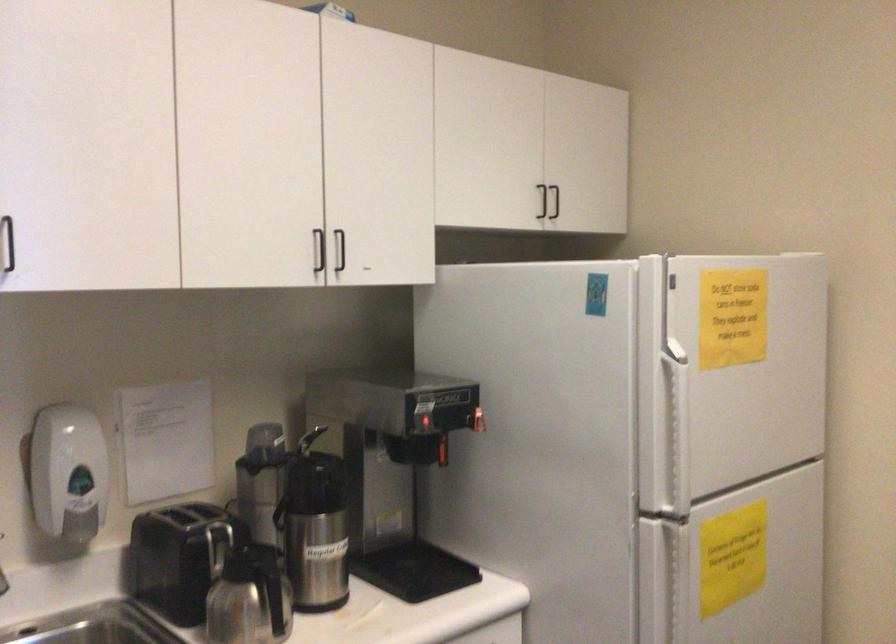
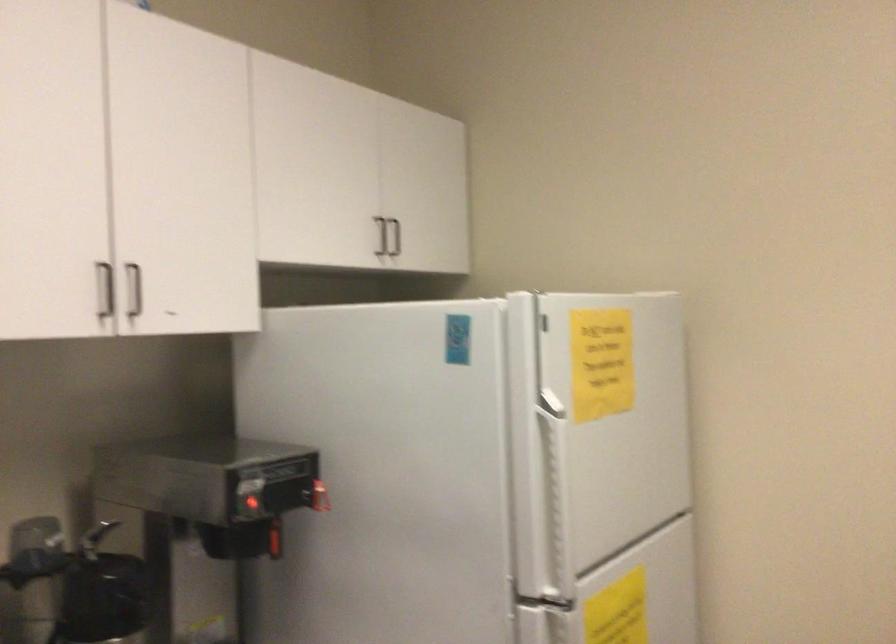
In the second image, find the point that corresponds to (x=421, y=426) in the first image.

(250, 504)